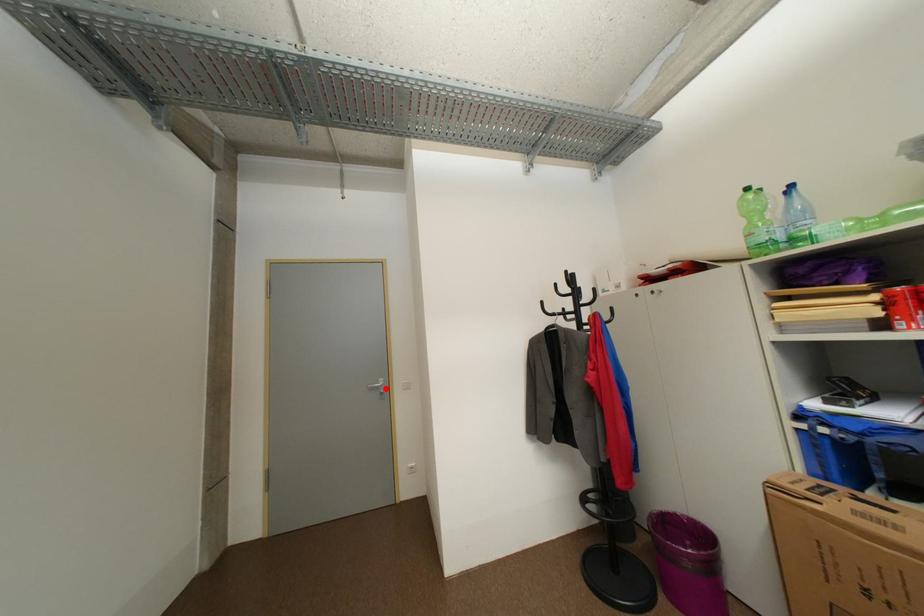
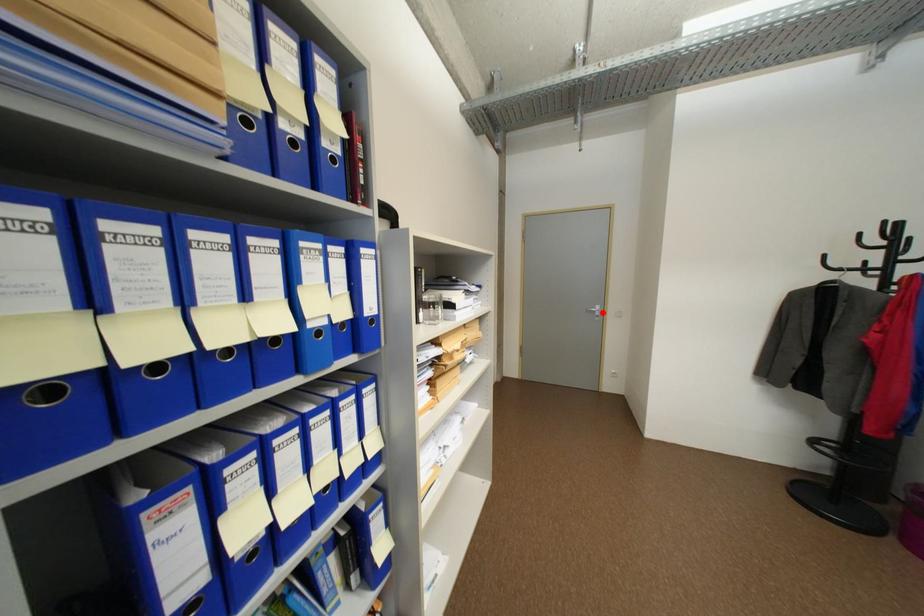
I am providing you with two images of the same scene from different viewpoints. A red point is marked on the first image and another point is marked on the second image. Does the point marked in image1 correspond to the same location as the one in image2?

Yes